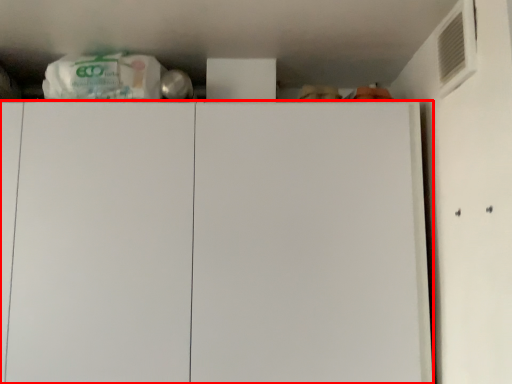
Question: From the image, what is the correct spatial relationship of cabinetry (annotated by the red box) in relation to air conditioning?

Choices:
 (A) right
 (B) left

Answer: (B)